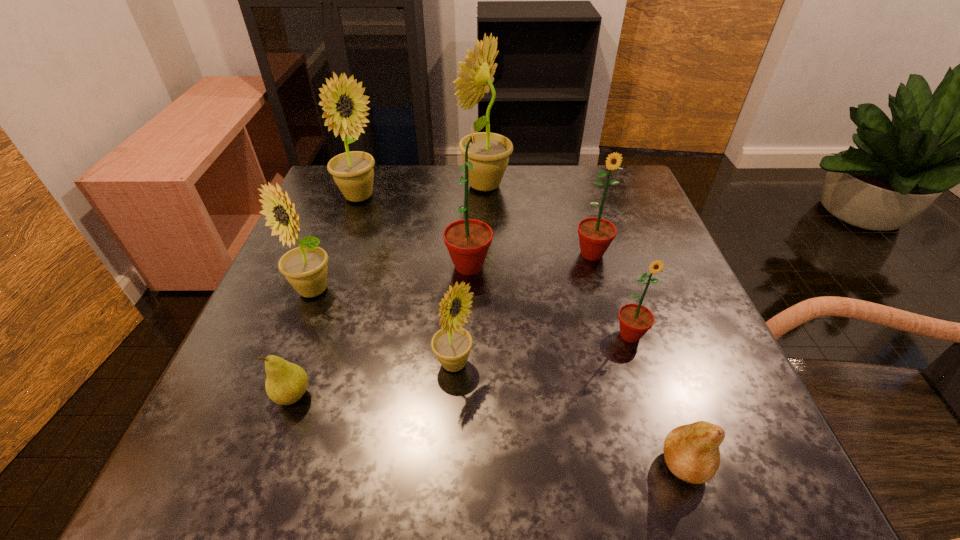
Select which object appears as the closest to the leftmost green sunflower. Please provide its 2D coordinates. Your answer should be formatted as a tuple, i.e. [(x, y)], where the tuple contains the x and y coordinates of a point satisfying the conditions above.

[(452, 344)]

Identify the location of object that stands as the sixth closest to the biggest green sunflower. (635, 320).

The width and height of the screenshot is (960, 540). Identify the location of the sixth closest sunflower to the third biggest yellow sunflower. (635, 320).

Identify the location of sunflower identified as the third closest to the tallest object. The height and width of the screenshot is (540, 960). 595,234.

Locate an element on the screen. The image size is (960, 540). yellow sunflower that is the third nearest to the leftmost green sunflower is located at coordinates (305, 267).

Identify which yellow sunflower is located as the second nearest to the smallest yellow sunflower. Please provide its 2D coordinates. Your answer should be formatted as a tuple, i.e. [(x, y)], where the tuple contains the x and y coordinates of a point satisfying the conditions above.

[(353, 173)]

Identify which green sunflower is the third nearest to the nearer pear. Please provide its 2D coordinates. Your answer should be formatted as a tuple, i.e. [(x, y)], where the tuple contains the x and y coordinates of a point satisfying the conditions above.

[(468, 240)]

Select which green sunflower appears as the third closest to the left pear. Please provide its 2D coordinates. Your answer should be formatted as a tuple, i.e. [(x, y)], where the tuple contains the x and y coordinates of a point satisfying the conditions above.

[(595, 234)]

I want to click on free spot that satisfies the following two spatial constraints: 1. on the face of the left pear; 2. on the left side of the third smallest yellow sunflower, so click(286, 396).

Locate an element on the screen. Image resolution: width=960 pixels, height=540 pixels. free space that satisfies the following two spatial constraints: 1. on the face of the nearest green sunflower; 2. on the face of the smallest yellow sunflower is located at coordinates (639, 364).